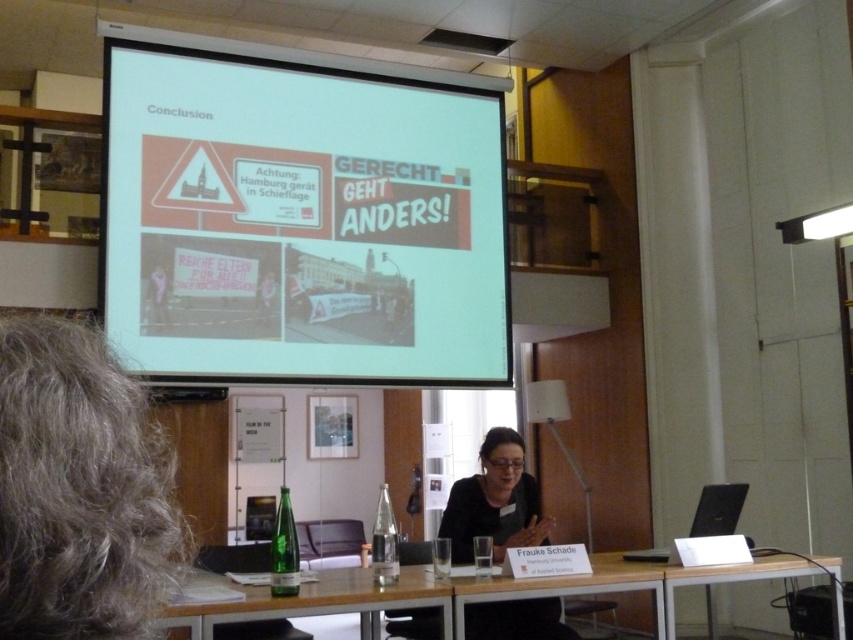
Between black fabric at center and white plastic table at lower right, which one has more height?

black fabric at center

Between black fabric at center and white plastic table at lower right, which one appears on the left side from the viewer's perspective?

black fabric at center

Does point (560, 637) lie behind point (677, 582)?

That is True.

Identify the location of black fabric at center. (495, 500).

Does white glossy projector screen at upper center have a greater width compared to black fabric at center?

Yes, white glossy projector screen at upper center is wider than black fabric at center.

Consider the image. Who is shorter, white glossy projector screen at upper center or black fabric at center?

black fabric at center

Locate an element on the screen. white glossy projector screen at upper center is located at coordinates (300, 216).

Locate an element on the screen. This screenshot has height=640, width=853. white glossy projector screen at upper center is located at coordinates (300, 216).

Can you confirm if white glossy projector screen at upper center is wider than green glass bottle at lower center?

Correct, the width of white glossy projector screen at upper center exceeds that of green glass bottle at lower center.

Locate an element on the screen. The image size is (853, 640). white glossy projector screen at upper center is located at coordinates (300, 216).